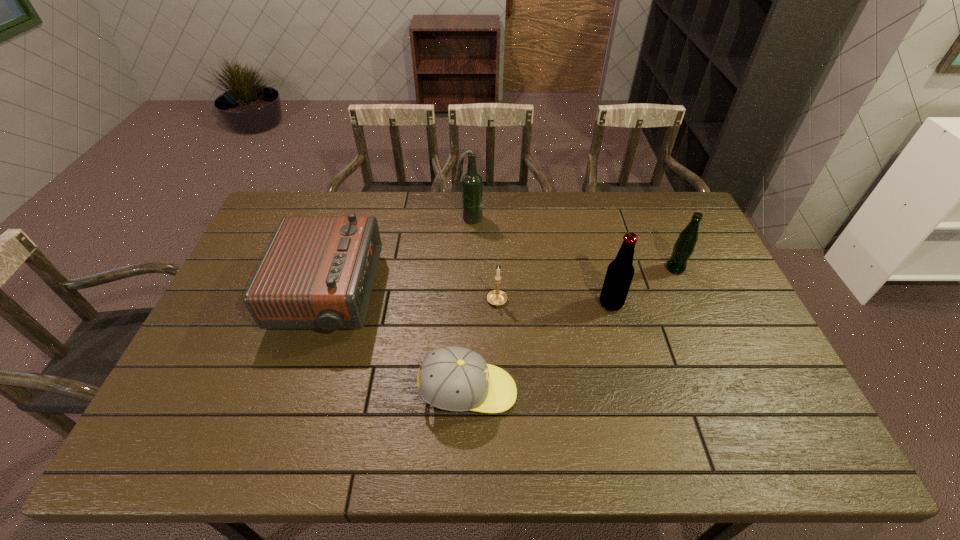
The image size is (960, 540). Find the location of `free space located on the front of the second beer bottle from left to right`. free space located on the front of the second beer bottle from left to right is located at coordinates (636, 395).

Where is `free space located 0.270m on the back of the rightmost object`? Image resolution: width=960 pixels, height=540 pixels. free space located 0.270m on the back of the rightmost object is located at coordinates (650, 210).

I want to click on vacant space located on the front panel of the leftmost object, so click(x=398, y=295).

Find the location of a particular element. The image size is (960, 540). vacant space located 0.050m on the handle side of the candle holder is located at coordinates (498, 326).

At what (x,y) coordinates should I click in order to perform the action: click on vacant space located on the front-facing side of the nearest object. Please return your answer as a coordinate pair (x, y). The height and width of the screenshot is (540, 960). Looking at the image, I should click on (601, 392).

In order to click on object at the far edge in this screenshot , I will do `click(472, 185)`.

Locate an element on the screen. Image resolution: width=960 pixels, height=540 pixels. object situated at the left edge is located at coordinates (318, 272).

The image size is (960, 540). In order to click on object positioned at the right edge in this screenshot , I will do `click(684, 246)`.

Locate an element on the screen. The image size is (960, 540). free region at the far edge of the desktop is located at coordinates (397, 227).

Find the location of `vacant space at the near edge of the desktop`. vacant space at the near edge of the desktop is located at coordinates (586, 441).